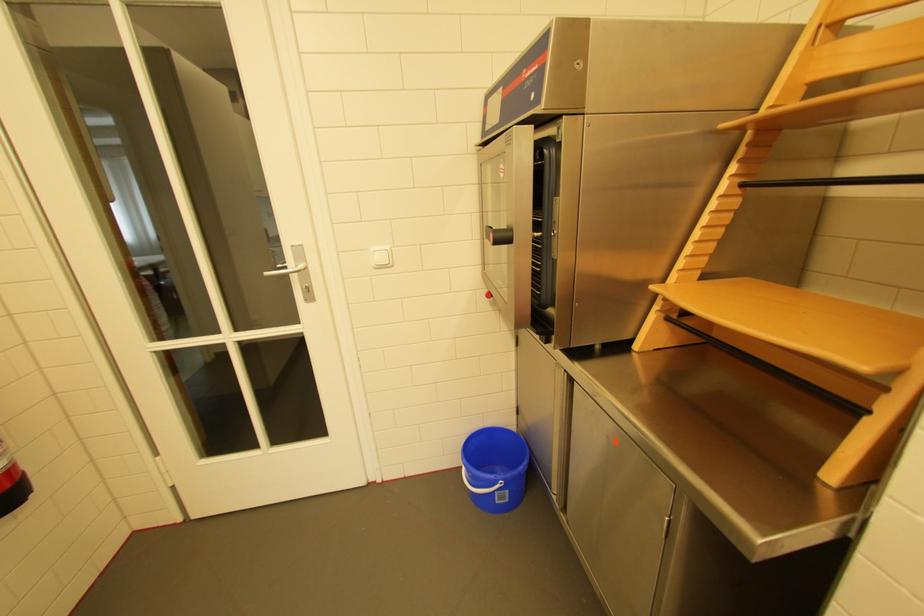
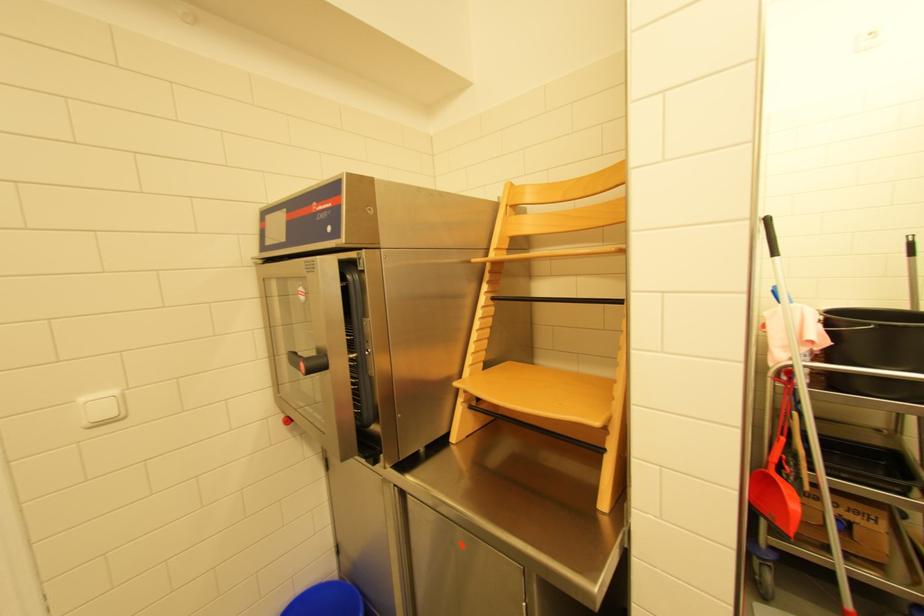
Locate, in the second image, the point that corresponds to (869,368) in the first image.

(603, 424)